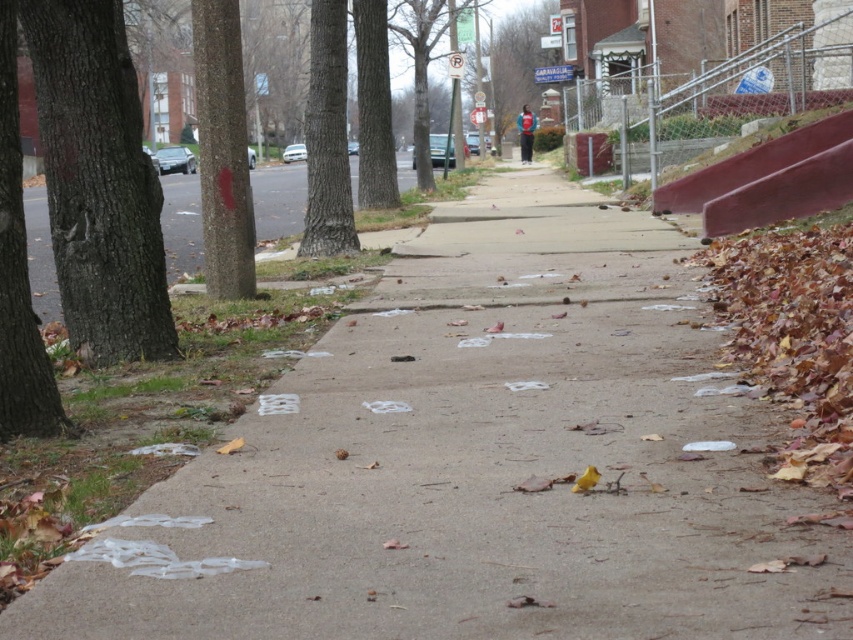
How much distance is there between smooth red concrete stairs at right and brown dirt sidewalk at left?

smooth red concrete stairs at right and brown dirt sidewalk at left are 15.75 meters apart.

Does smooth red concrete stairs at right come in front of brown dirt sidewalk at left?

No, smooth red concrete stairs at right is further to the viewer.

Where is `smooth red concrete stairs at right`? smooth red concrete stairs at right is located at coordinates (769, 180).

Locate an element on the screen. smooth red concrete stairs at right is located at coordinates [x=769, y=180].

Between smooth red concrete stairs at right and brown rough tree at left, which one appears on the right side from the viewer's perspective?

smooth red concrete stairs at right

You are a GUI agent. You are given a task and a screenshot of the screen. Output one action in this format:
    pyautogui.click(x=<x>, y=<y>)
    Task: Click on the smooth red concrete stairs at right
    This screenshot has width=853, height=640.
    Given the screenshot: What is the action you would take?
    pyautogui.click(x=769, y=180)

Is point (13, 326) farther from camera compared to point (329, 182)?

That is False.

At what (x,y) coordinates should I click in order to perform the action: click on brown rough tree at left. Please return your answer as a coordinate pair (x, y). Looking at the image, I should click on (18, 275).